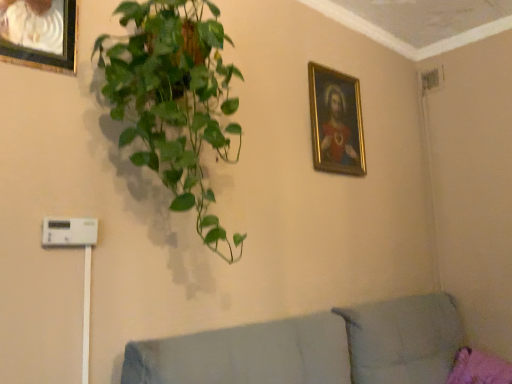
Question: Is green glossy plant at upper left bigger than gold-framed painting at upper right, which is the 2th picture frame from left to right?

Choices:
 (A) no
 (B) yes

Answer: (B)

Question: From the image's perspective, does green glossy plant at upper left appear higher than gold-framed painting at upper right, which is the 2th picture frame from left to right?

Choices:
 (A) no
 (B) yes

Answer: (A)

Question: Is green glossy plant at upper left at the left side of gold-framed painting at upper right, the first picture frame when ordered from back to front?

Choices:
 (A) yes
 (B) no

Answer: (A)

Question: Can you confirm if green glossy plant at upper left is wider than gold-framed painting at upper right, acting as the second picture frame starting from the front?

Choices:
 (A) yes
 (B) no

Answer: (A)

Question: From a real-world perspective, is green glossy plant at upper left on gold-framed painting at upper right, the first picture frame when ordered from back to front?

Choices:
 (A) yes
 (B) no

Answer: (B)

Question: In the image, is green glossy plant at upper left on the left side or the right side of light gray fabric couch at lower right?

Choices:
 (A) left
 (B) right

Answer: (A)

Question: From a real-world perspective, relative to light gray fabric couch at lower right, is green glossy plant at upper left vertically above or below?

Choices:
 (A) above
 (B) below

Answer: (A)

Question: From the image's perspective, is green glossy plant at upper left located above or below light gray fabric couch at lower right?

Choices:
 (A) above
 (B) below

Answer: (A)

Question: Considering their positions, is green glossy plant at upper left located in front of or behind light gray fabric couch at lower right?

Choices:
 (A) front
 (B) behind

Answer: (B)

Question: From a real-world perspective, relative to brushed metal picture frame at upper left, which appears as the first picture frame when viewed from the front, is white plastic light switch at lower left vertically above or below?

Choices:
 (A) above
 (B) below

Answer: (B)

Question: In the image, is white plastic light switch at lower left on the left side or the right side of brushed metal picture frame at upper left, which appears as the first picture frame when viewed from the left?

Choices:
 (A) left
 (B) right

Answer: (B)

Question: Looking at the image, does white plastic light switch at lower left seem bigger or smaller compared to brushed metal picture frame at upper left, which ranks as the second picture frame in back-to-front order?

Choices:
 (A) small
 (B) big

Answer: (A)

Question: Relative to brushed metal picture frame at upper left, positioned as the second picture frame in right-to-left order, is white plastic light switch at lower left in front or behind?

Choices:
 (A) front
 (B) behind

Answer: (B)

Question: In terms of width, does light gray fabric couch at lower right look wider or thinner when compared to white plastic light switch at lower left?

Choices:
 (A) wide
 (B) thin

Answer: (A)

Question: From a real-world perspective, is light gray fabric couch at lower right physically located above or below white plastic light switch at lower left?

Choices:
 (A) above
 (B) below

Answer: (B)